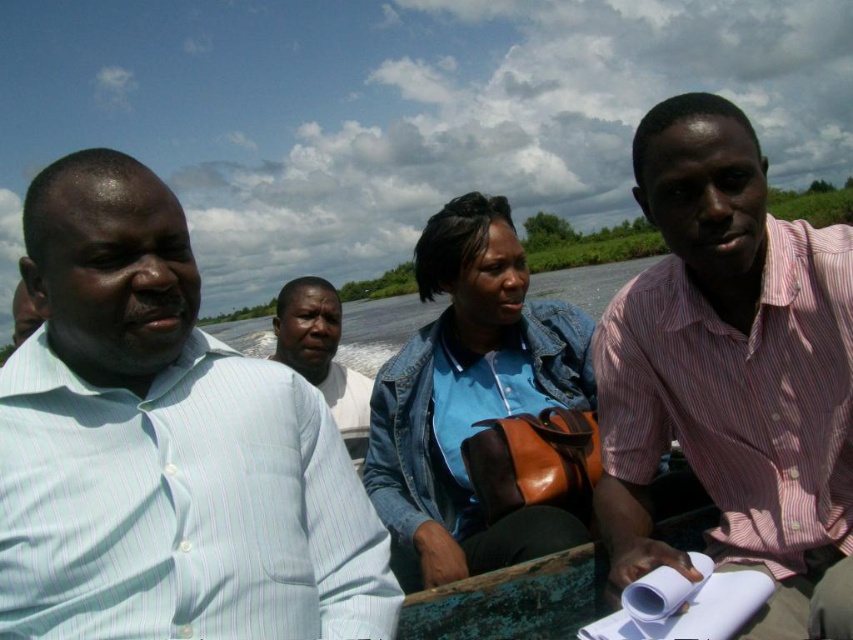
You are on a boat with four people. You notice two individuals wearing a light blue striped shirt at left and a blue denim jacket at center. Which one is positioned closer to the left side of the boat?

The light blue striped shirt at left is positioned to the left of the blue denim jacket at center, so the light blue striped shirt at left is closer to the left side of the boat.

You are a photographer trying to capture a clear shot of the blue denim jacket at center and the light blue striped shirt at center. Which one should you focus on first to ensure it appears sharp in the photo?

The blue denim jacket at center is closer to the viewer than the light blue striped shirt at center, so you should focus on the blue denim jacket at center first to ensure it appears sharp in the photo.

You are standing on the dock and want to hand a pink striped shirt to someone in the boat. The boat is currently at position point (732, 372). Who is located at that point?

The pink striped shirt at right is located at point (732, 372).